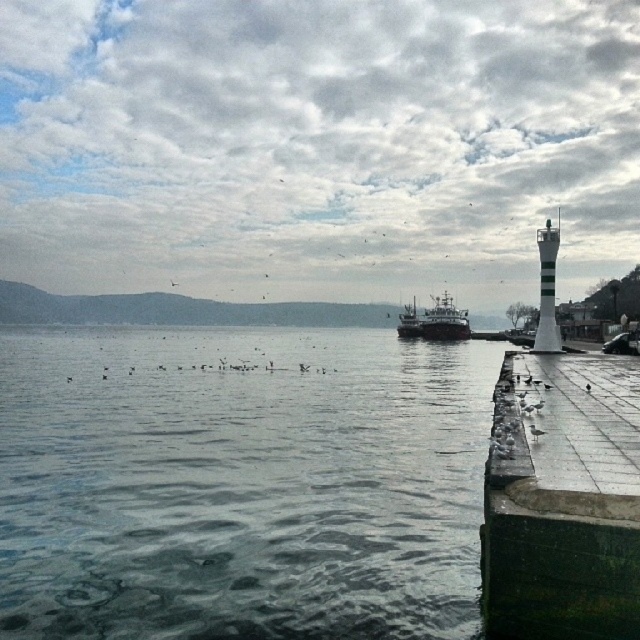
From the picture: You are standing at the center of the image and want to reach the green concrete dock at lower right. Which direction should you move towards?

You should move towards the lower right direction to reach the green concrete dock at lower right.

You are standing on the green concrete dock at lower right and want to step onto the gray matte water at lower left. Is this possible?

The gray matte water at lower left is positioned under green concrete dock at lower right, so stepping onto it from the dock would require moving downward, which is not feasible for a person to do safely.